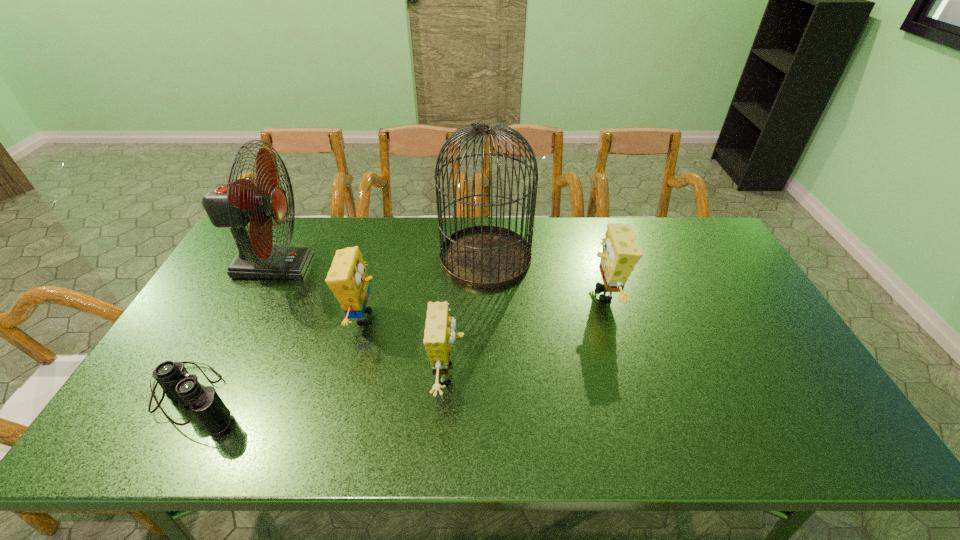
Where is `vacant area between the third object from left to right and the shortest object`? vacant area between the third object from left to right and the shortest object is located at coordinates (278, 358).

I want to click on free area in between the binoculars and the leftmost sponge, so click(x=278, y=358).

Identify the location of free space between the binoculars and the second sponge from right to left. The height and width of the screenshot is (540, 960). (321, 387).

Locate an element on the screen. free space between the fourth object from right to left and the rightmost object is located at coordinates (484, 305).

The height and width of the screenshot is (540, 960). I want to click on free area in between the second sponge from left to right and the leftmost sponge, so click(406, 346).

In order to click on empty location between the leftmost sponge and the rightmost sponge in this screenshot , I will do `click(484, 305)`.

The height and width of the screenshot is (540, 960). What are the coordinates of `the second closest object to the fan` in the screenshot? It's located at tap(179, 386).

The height and width of the screenshot is (540, 960). Identify the location of the third closest object to the birdcage. (439, 335).

Image resolution: width=960 pixels, height=540 pixels. In order to click on the closest sponge to the rightmost sponge in this screenshot , I will do `click(439, 335)`.

Select which sponge is the closest to the rightmost object. Please provide its 2D coordinates. Your answer should be formatted as a tuple, i.e. [(x, y)], where the tuple contains the x and y coordinates of a point satisfying the conditions above.

[(439, 335)]